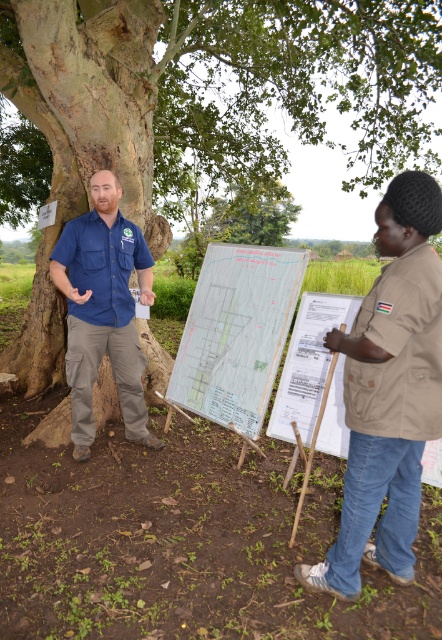
Is brown fabric shirt at right to the left of white paper map at center from the viewer's perspective?

Incorrect, brown fabric shirt at right is not on the left side of white paper map at center.

From the picture: Can you confirm if brown fabric shirt at right is smaller than white paper map at center?

Yes, brown fabric shirt at right is smaller than white paper map at center.

Identify the location of brown fabric shirt at right. 388,392.

You are a GUI agent. You are given a task and a screenshot of the screen. Output one action in this format:
    pyautogui.click(x=<x>, y=<y>)
    Task: Click on the brown fabric shirt at right
    The height and width of the screenshot is (640, 442).
    Given the screenshot: What is the action you would take?
    388,392

Which is more to the right, brown fabric shirt at right or matte blue shirt at left?

Result: Positioned to the right is brown fabric shirt at right.

Between brown fabric shirt at right and matte blue shirt at left, which one is positioned higher?

matte blue shirt at left is higher up.

You are a GUI agent. You are given a task and a screenshot of the screen. Output one action in this format:
    pyautogui.click(x=<x>, y=<y>)
    Task: Click on the brown fabric shirt at right
    
    Given the screenshot: What is the action you would take?
    pyautogui.click(x=388, y=392)

At what (x,y) coordinates should I click in order to perform the action: click on brown fabric shirt at right. Please return your answer as a coordinate pair (x, y). This screenshot has width=442, height=640. Looking at the image, I should click on click(x=388, y=392).

Measure the distance between white paper map at center and matte blue shirt at left.

A distance of 82.93 centimeters exists between white paper map at center and matte blue shirt at left.

Which is more to the left, white paper map at center or matte blue shirt at left?

matte blue shirt at left is more to the left.

Is point (271, 362) positioned in front of point (72, 412)?

That is True.

You are a GUI agent. You are given a task and a screenshot of the screen. Output one action in this format:
    pyautogui.click(x=<x>, y=<y>)
    Task: Click on the white paper map at center
    
    Given the screenshot: What is the action you would take?
    pyautogui.click(x=236, y=332)